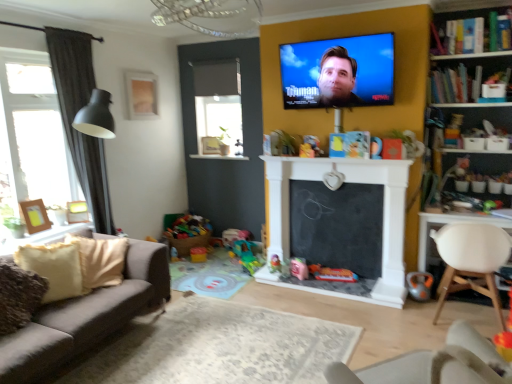
Question: In the image, is matte gold picture frame at upper left, positioned as the 3th picture frame in front-to-back order, positioned in front of or behind wooden photo frame at left, the 1th picture frame from the bottom?

Choices:
 (A) behind
 (B) front

Answer: (A)

Question: From a real-world perspective, relative to wooden photo frame at left, which is counted as the third picture frame, starting from the back, is matte gold picture frame at upper left, which is counted as the first picture frame, starting from the back, vertically above or below?

Choices:
 (A) below
 (B) above

Answer: (B)

Question: Estimate the real-world distances between objects in this image. Which object is farther from the black chalkboard at center?

Choices:
 (A) plastic colorful toy at center, the sixth toy viewed from the left
 (B) dark grey fabric curtain at left
 (C) white matte chair at right, positioned as the 1th chair in back-to-front order
 (D) wooden bookshelf at upper right
 (E) metallic orange toy at lower right, the 1th toy in the front-to-back sequence

Answer: (B)

Question: Which is farther from the matte gold picture frame at upper left, which ranks as the first picture frame in top-to-bottom order?

Choices:
 (A) bright multicolored plastic toys at lower left, the 2th toy viewed from the top
 (B) plastic green toy at center, which is the 3th toy in back-to-front order
 (C) dark grey fabric curtain at left
 (D) black chalkboard at center
 (E) wooden photo frame at left, the first picture frame in the front-to-back sequence

Answer: (D)